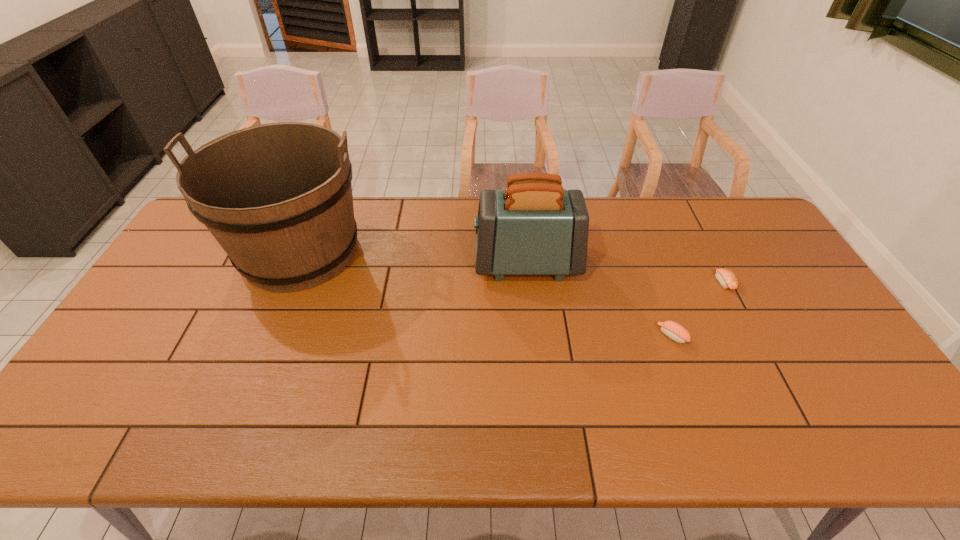
Where is `bucket`? bucket is located at coordinates point(277,197).

The width and height of the screenshot is (960, 540). I want to click on the tallest object, so click(x=277, y=197).

Locate an element on the screen. Image resolution: width=960 pixels, height=540 pixels. the second object from left to right is located at coordinates (534, 227).

This screenshot has width=960, height=540. Find the location of `toaster`. toaster is located at coordinates (534, 227).

Where is `the taller sushi`? This screenshot has height=540, width=960. the taller sushi is located at coordinates (673, 330).

Locate an element on the screen. the left sushi is located at coordinates (673, 330).

Where is `the farther sushi`? the farther sushi is located at coordinates (727, 279).

Locate an element on the screen. The height and width of the screenshot is (540, 960). the shorter sushi is located at coordinates (727, 279).

Find the location of a particular element. free space located 0.330m on the front of the leftmost object is located at coordinates (234, 410).

This screenshot has height=540, width=960. I want to click on free region located 0.340m on the front-facing side of the second tallest object, so click(366, 263).